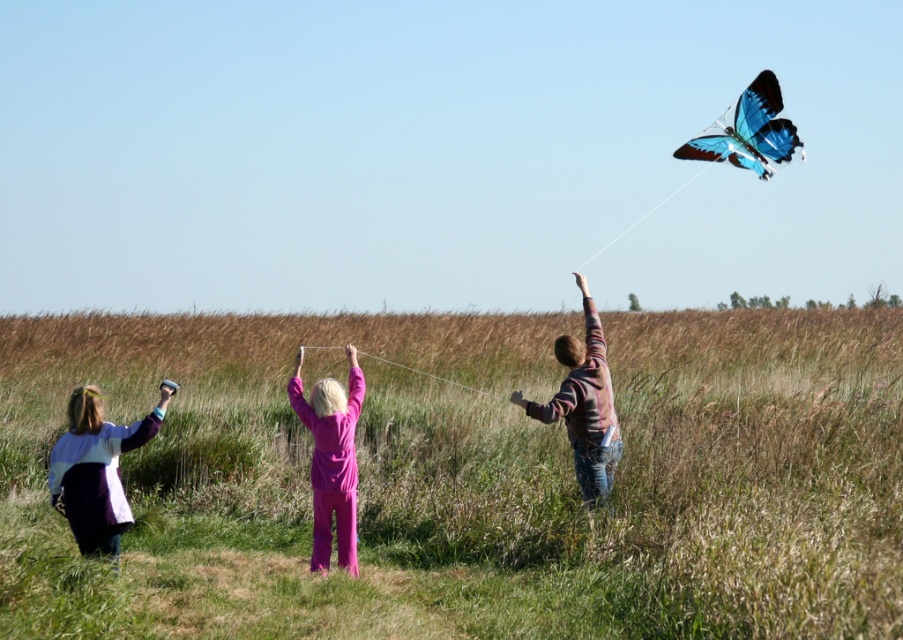
You are trying to locate the purple matte pants at center in the image. According to the scene description, where is it positioned relative to the white string at center?

The purple matte pants at center are to the right of the white string at center.

You are a visitor in the field and want to know if you can walk between the purple matte pants at center and the white string at center without stepping on either. The path between them is 14.57 feet wide. If you need a path at least 12 feet wide to walk comfortably, can you walk between them?

The path between the purple matte pants at center and the white string at center is 14.57 feet, which is wider than the required 12 feet. Therefore, you can walk between them comfortably without stepping on either object.

You are a photographer trying to capture a group photo of the white cotton shirt at lower left and the striped sweater at center. Which person should you focus on to ensure they appear larger in the photo?

The striped sweater at center should be focused on because it occupies more space in the image compared to the white cotton shirt at lower left.